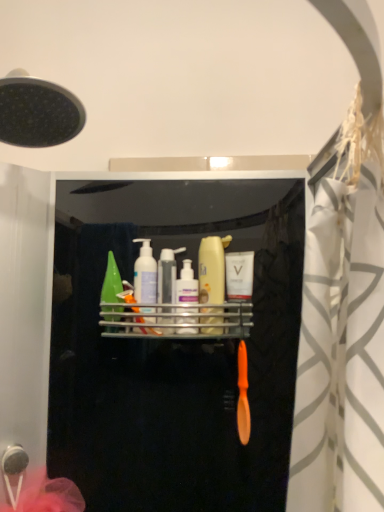
Question: From the image's perspective, is translucent plastic mouthwash at center, placed as the fourth mouthwash when sorted from left to right, positioned above or below translucent plastic mouthwash at center, which appears as the 3th mouthwash when viewed from the right?

Choices:
 (A) above
 (B) below

Answer: (A)

Question: Which is correct: translucent plastic mouthwash at center, positioned as the 2th mouthwash in right-to-left order, is inside translucent plastic mouthwash at center, placed as the third mouthwash when sorted from left to right, or outside of it?

Choices:
 (A) inside
 (B) outside

Answer: (B)

Question: Which of these objects is positioned closest to the metallic silver shelf at center?

Choices:
 (A) translucent plastic mouthwash at center, which appears as the 3th mouthwash when viewed from the right
 (B) white glossy mouthwash at center, placed as the fifth mouthwash when sorted from left to right
 (C) green plastic bottle at center, marked as the 1th mouthwash in a left-to-right arrangement
 (D) translucent green bottle at center, marked as the 2th mouthwash in a left-to-right arrangement
 (E) translucent plastic bottle at center

Answer: (A)

Question: Which object is the farthest from the metallic silver shelf at center?

Choices:
 (A) translucent plastic mouthwash at center, positioned as the 2th mouthwash in right-to-left order
 (B) translucent plastic mouthwash at center, which appears as the 3th mouthwash when viewed from the right
 (C) white glossy mouthwash at center, placed as the fifth mouthwash when sorted from left to right
 (D) translucent plastic bottle at center
 (E) green plastic bottle at center, acting as the fifth mouthwash starting from the right

Answer: (E)